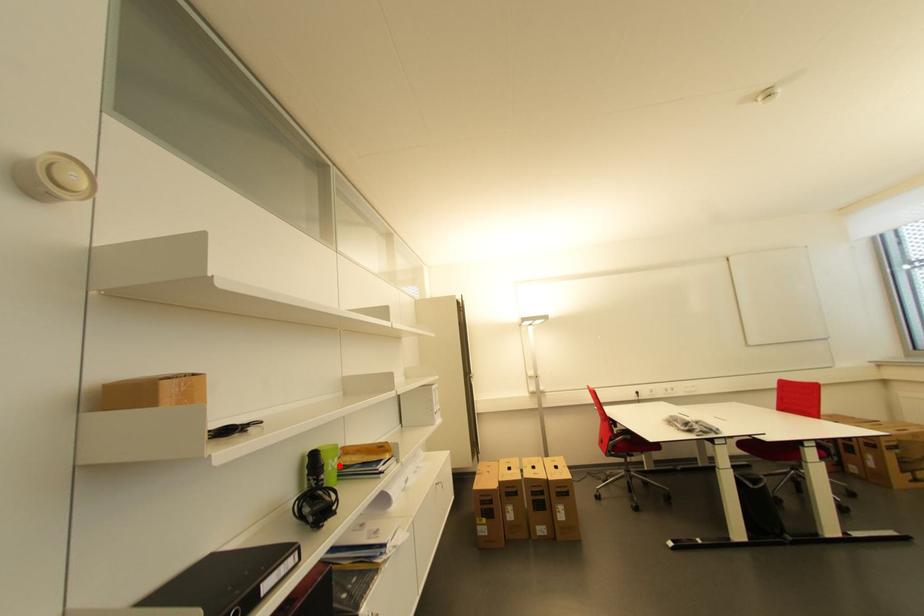
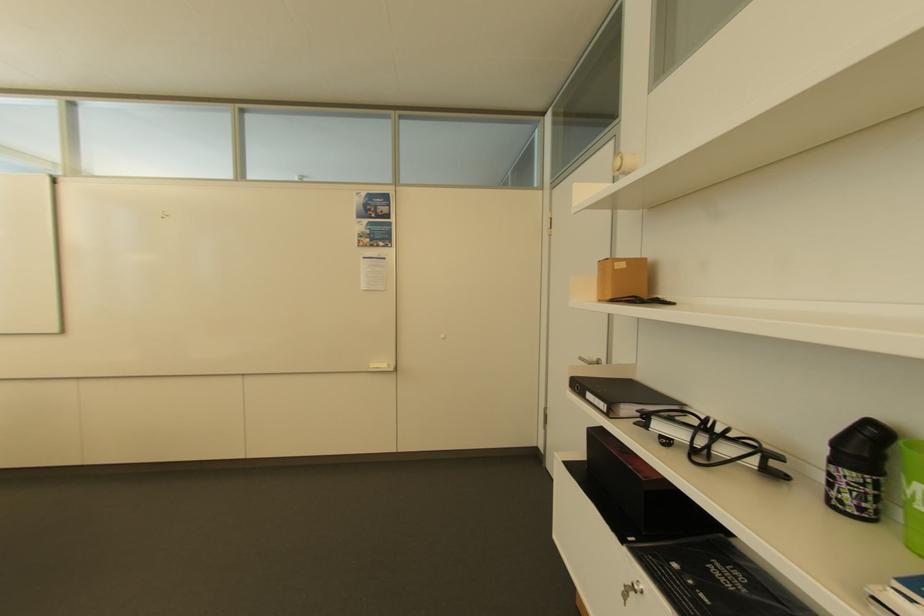
Locate, in the second image, the point that corresponds to the highlighted location in the first image.

(916, 493)